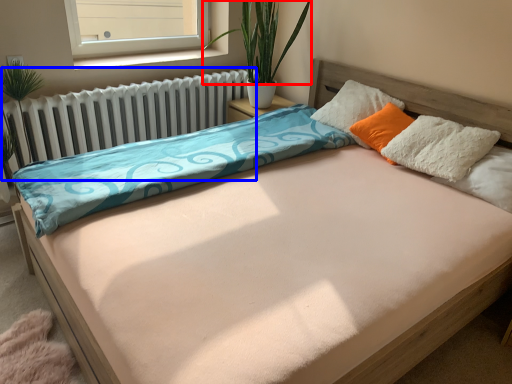
Question: Among these objects, which one is farthest to the camera, plant (highlighted by a red box) or radiator (highlighted by a blue box)?

Choices:
 (A) plant
 (B) radiator

Answer: (A)